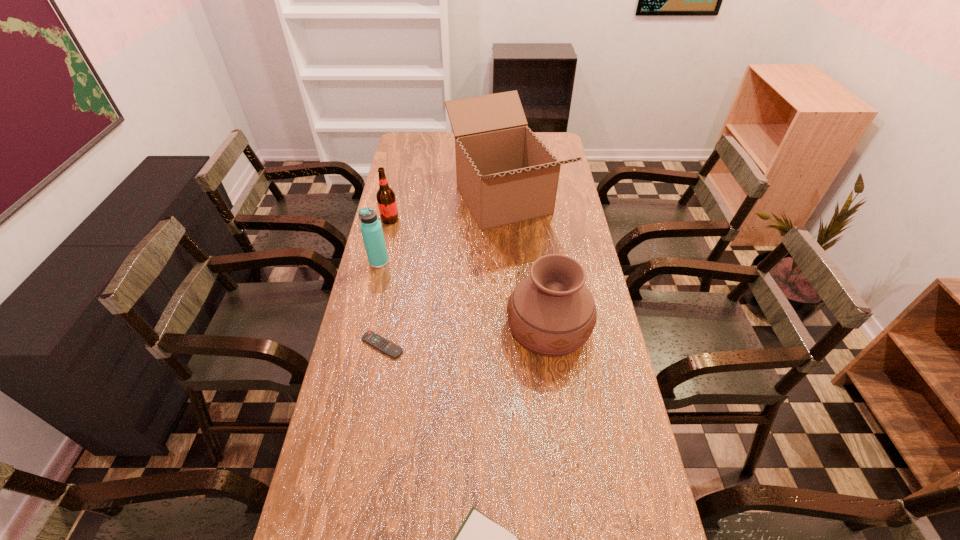
This screenshot has height=540, width=960. Identify the location of unoccupied position between the urn and the root beer. click(x=469, y=274).

I want to click on vacant area that lies between the tallest object and the root beer, so click(446, 210).

Identify the location of vacant area between the box and the shortest object. This screenshot has width=960, height=540. (443, 273).

Locate an element on the screen. vacant area that lies between the tallest object and the remote control is located at coordinates (443, 273).

The image size is (960, 540). In order to click on vacant area between the urn and the fourth nearest object in this screenshot , I will do `click(464, 295)`.

The width and height of the screenshot is (960, 540). In order to click on free space that is in between the box and the root beer in this screenshot , I will do `click(446, 210)`.

This screenshot has width=960, height=540. I want to click on empty space between the thermos bottle and the tallest object, so click(442, 231).

Where is `object that stands as the fourth closest to the box`? object that stands as the fourth closest to the box is located at coordinates (387, 347).

Image resolution: width=960 pixels, height=540 pixels. Find the location of `object that is the closest to the remote control`. object that is the closest to the remote control is located at coordinates (371, 228).

Find the location of a particular element. The height and width of the screenshot is (540, 960). free location that satisfies the following two spatial constraints: 1. on the front side of the root beer; 2. on the right side of the urn is located at coordinates (366, 328).